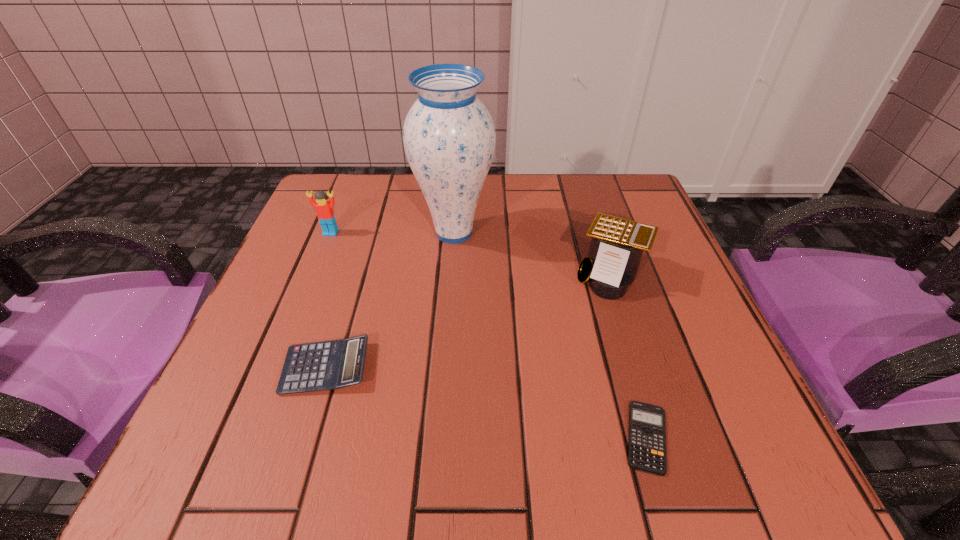
I want to click on vacant space in between the leftmost calculator and the farthest calculator, so click(468, 321).

Where is `free space between the tallest calculator and the Lego`? free space between the tallest calculator and the Lego is located at coordinates (471, 254).

Where is `empty space that is in between the nearest object and the Lego`? empty space that is in between the nearest object and the Lego is located at coordinates (489, 335).

Locate an element on the screen. This screenshot has width=960, height=540. vacant space that's between the vase and the farthest calculator is located at coordinates (533, 254).

At what (x,y) coordinates should I click in order to perform the action: click on vacant region between the farthest calculator and the shortest calculator. Please return your answer as a coordinate pair (x, y). Looking at the image, I should click on (629, 356).

You are a GUI agent. You are given a task and a screenshot of the screen. Output one action in this format:
    pyautogui.click(x=<x>, y=<y>)
    Task: Click on the empty space that is in between the nearest calculator and the tallest calculator
    Image resolution: width=960 pixels, height=540 pixels.
    Given the screenshot: What is the action you would take?
    pyautogui.click(x=629, y=356)

Locate an element on the screen. The image size is (960, 540). empty location between the leftmost calculator and the nearest object is located at coordinates (486, 402).

You are a GUI agent. You are given a task and a screenshot of the screen. Output one action in this format:
    pyautogui.click(x=<x>, y=<y>)
    Task: Click on the vacant region between the Lego and the fourth farthest object
    This screenshot has height=540, width=960.
    Given the screenshot: What is the action you would take?
    pyautogui.click(x=328, y=300)

I want to click on object that stands as the second closest to the vase, so click(x=617, y=244).

Identify which object is located as the nearest to the leftmost calculator. Please provide its 2D coordinates. Your answer should be formatted as a tuple, i.e. [(x, y)], where the tuple contains the x and y coordinates of a point satisfying the conditions above.

[(449, 137)]